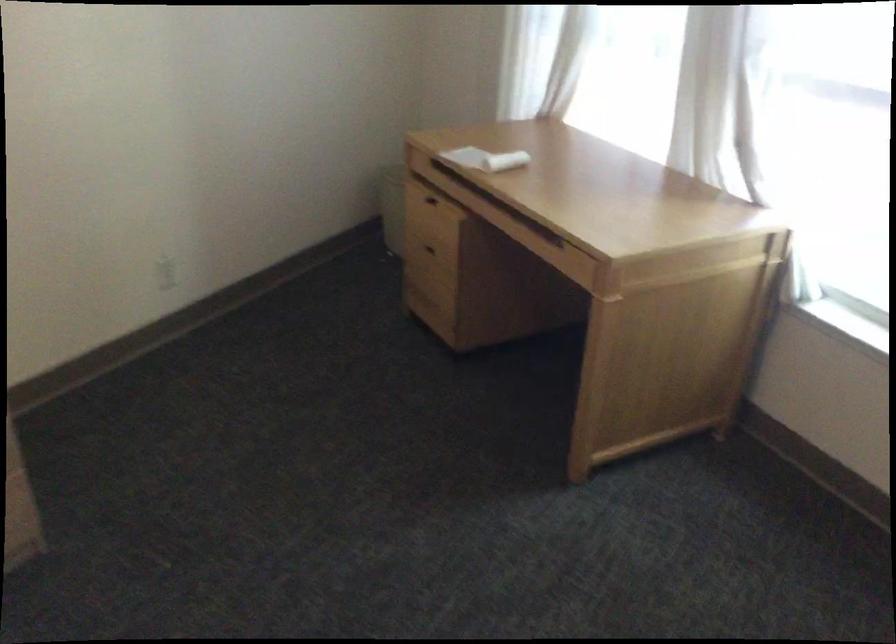
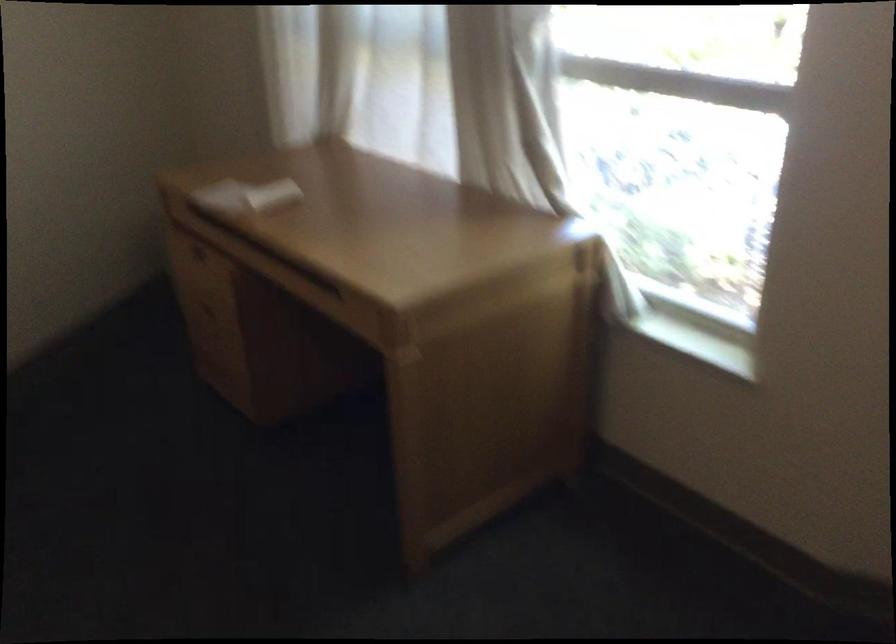
The point at (469, 149) is marked in the first image. Where is the corresponding point in the second image?

(234, 191)